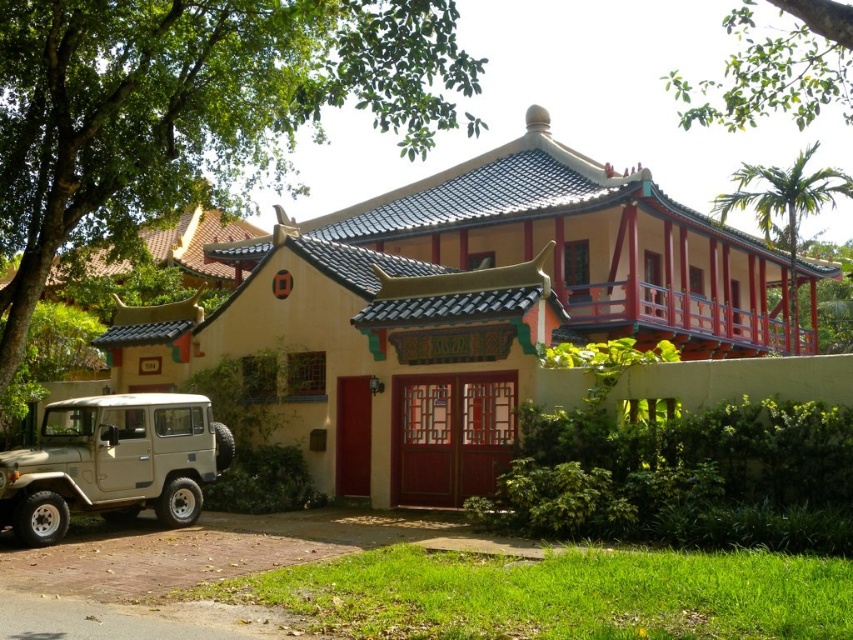
Between green leafy branch at upper center and green leafy tree at upper right, which one is positioned higher?

green leafy branch at upper center is higher up.

Does point (788, 100) come closer to viewer compared to point (753, 164)?

Yes, point (788, 100) is closer to viewer.

The image size is (853, 640). Identify the location of green leafy branch at upper center. (775, 67).

Does green leafy tree at upper left have a smaller size compared to matte khaki jeep at lower left?

No.

Is green leafy tree at upper left to the left of matte khaki jeep at lower left from the viewer's perspective?

Incorrect, green leafy tree at upper left is not on the left side of matte khaki jeep at lower left.

What do you see at coordinates (189, 109) in the screenshot? The height and width of the screenshot is (640, 853). I see `green leafy tree at upper left` at bounding box center [189, 109].

The height and width of the screenshot is (640, 853). In order to click on green leafy tree at upper left in this screenshot , I will do `click(189, 109)`.

Is green leafy tree at upper left further to camera compared to green leafy tree at upper right?

No, it is not.

This screenshot has height=640, width=853. Identify the location of green leafy tree at upper left. (189, 109).

Is point (341, 35) farther from camera compared to point (767, 186)?

No.

Where is `green leafy tree at upper left`? green leafy tree at upper left is located at coordinates (189, 109).